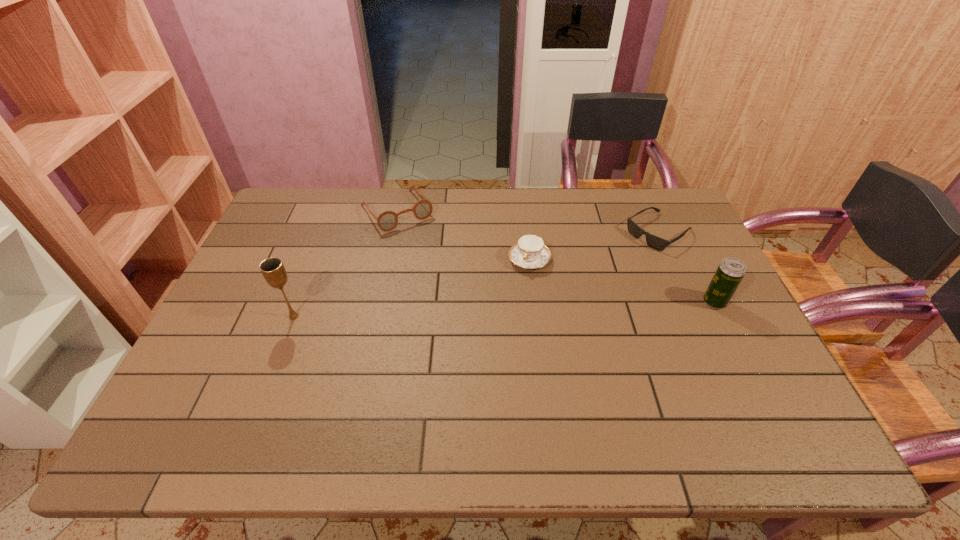
Locate an element on the screen. The image size is (960, 540). free spot located on the side with the handle of the third object from right to left is located at coordinates (514, 292).

This screenshot has width=960, height=540. What are the coordinates of `free space located on the front-facing side of the fourth object from right to left` in the screenshot? It's located at (420, 244).

Find the location of a particular element. This screenshot has width=960, height=540. free location located 0.320m on the front-facing side of the fourth object from right to left is located at coordinates (458, 294).

Where is `vacant region located on the front-facing side of the fourth object from right to left`? The height and width of the screenshot is (540, 960). vacant region located on the front-facing side of the fourth object from right to left is located at coordinates (422, 245).

The image size is (960, 540). What are the coordinates of `vacant space located 0.240m on the front-facing side of the sunglasses` in the screenshot? It's located at (588, 280).

This screenshot has height=540, width=960. Identify the location of blank space located on the front-facing side of the sunglasses. (626, 254).

I want to click on free spot located on the front-facing side of the sunglasses, so click(596, 274).

I want to click on spectacles at the far edge, so click(388, 220).

The image size is (960, 540). What are the coordinates of `sunglasses positioned at the far edge` in the screenshot? It's located at (x=652, y=241).

This screenshot has height=540, width=960. I want to click on beer can present at the right edge, so click(730, 272).